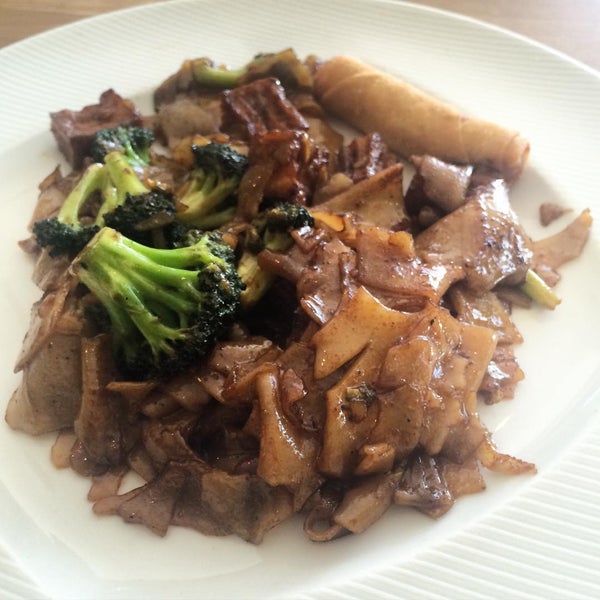
Locate an element on the screen. brown wooden table is located at coordinates (41, 17), (573, 17).